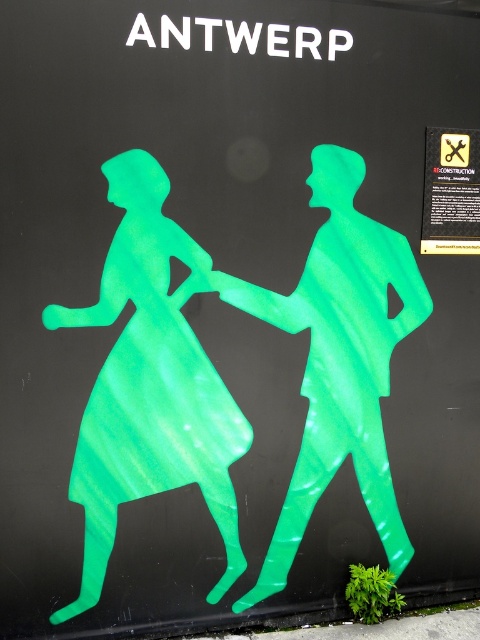
You are standing in front of a public art installation featuring two green translucent figures. The one on the left is labeled as the green translucent figure at left. If you want to take a photo of this figure without the other figure appearing in the frame, how far back should you step?

The green translucent figure at left is 2.60 meters away from the viewer. To ensure the other figure does not appear in the frame, you should step back at least 2.60 meters from the green translucent figure at left.

You are an art curator planning to install a spotlight on the green translucent figure at left and the green translucent figure at center in the image. Based on their positions, which figure should you adjust the spotlight to shine first from top to bottom?

The green translucent figure at left is located below the green translucent figure at center. Therefore, when shining the spotlight from top to bottom, you should start with the green translucent figure at center first since it is higher up, and then move to the lower one at left.